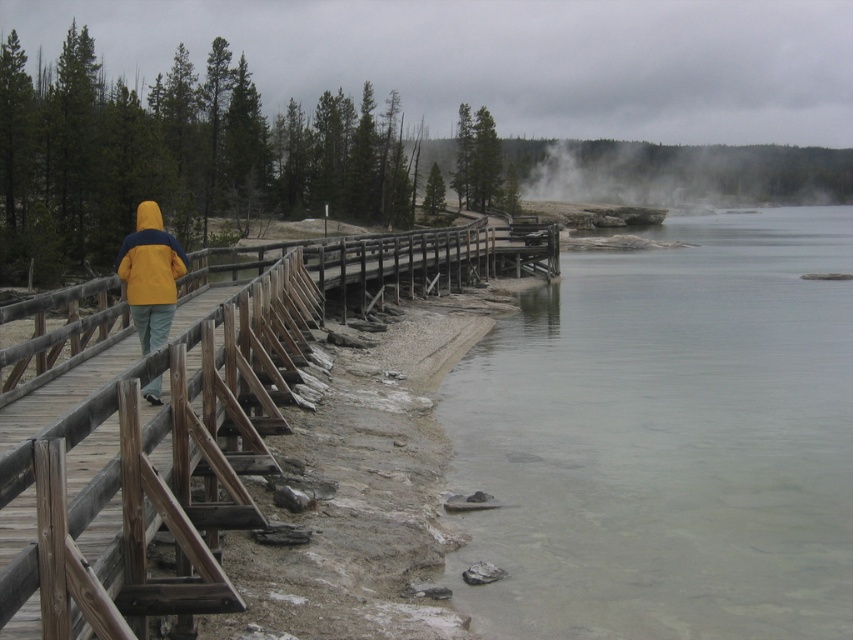
You are standing on the wooden boardwalk and want to take a photo of the clear water at lower right and the wooden rail at center. Which object will occupy more space in your photo?

The clear water at lower right has a larger size compared to the wooden rail at center, so it will occupy more space in the photo.

You are standing on the wooden boardwalk and notice the clear water at lower right and the yellow matte jacket at center. Which object takes up more space in the image?

The clear water at lower right takes up more space in the image because it is bigger than the yellow matte jacket at center.

You are standing at the center of the boardwalk and want to locate the clear water at lower right. Based on the coordinates provided, in which direction should you look to see it?

The clear water at lower right is located at coordinates point (x=666, y=438), so you should look towards the lower right direction from your current position at the center of the boardwalk.